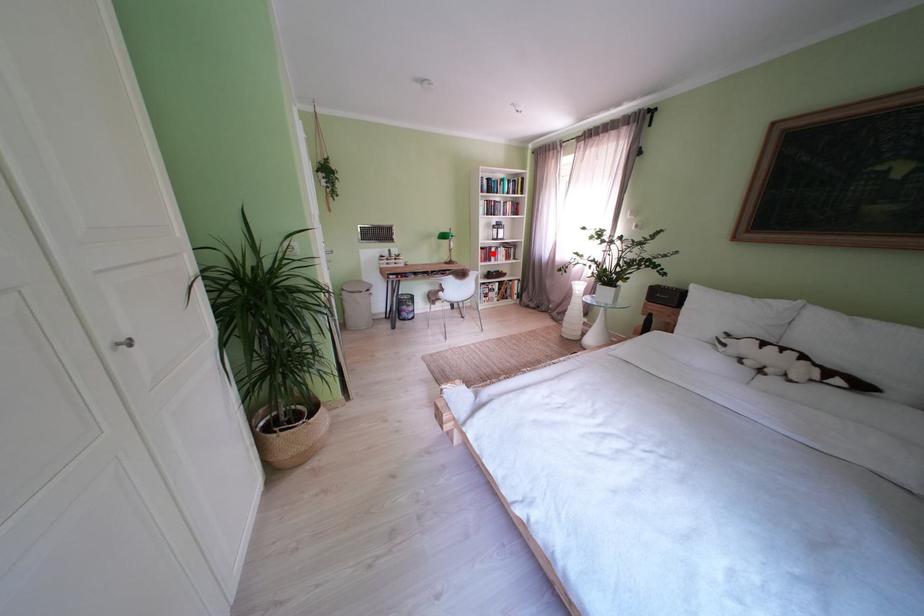
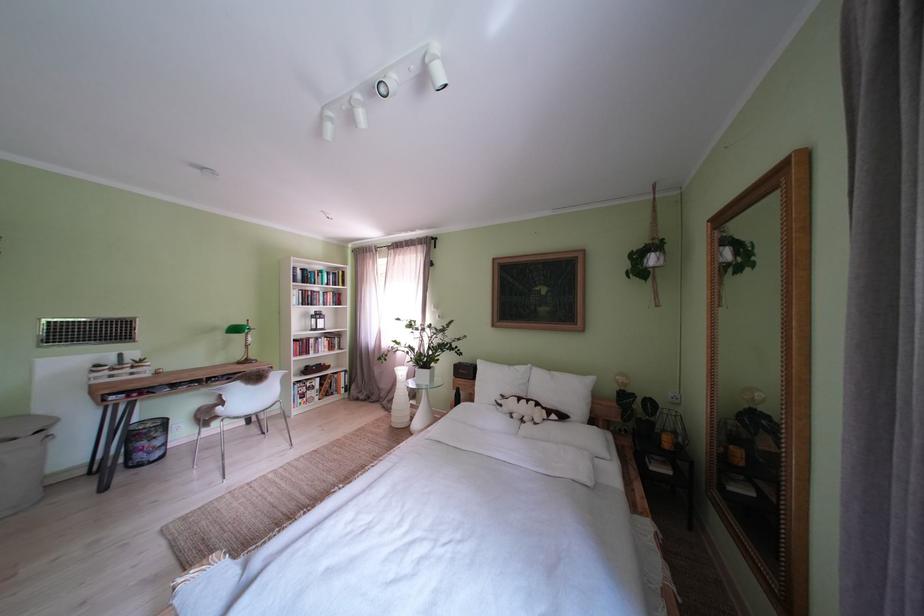
The point at the highlighted location is marked in the first image. Where is the corresponding point in the second image?

(307, 346)